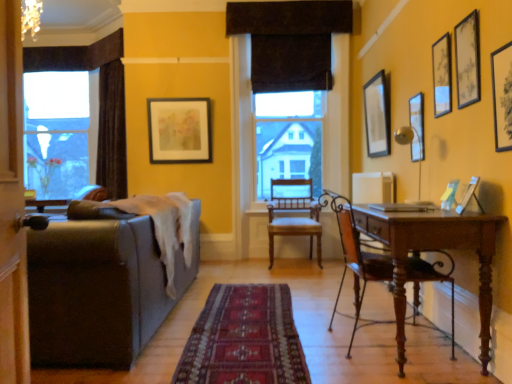
Question: Relative to leather couch at left, is matte black picture frame at upper right, which is counted as the 3th picture frame, starting from the back, in front or behind?

Choices:
 (A) front
 (B) behind

Answer: (B)

Question: Would you say matte black picture frame at upper right, the first picture frame positioned from the right, is to the left or to the right of leather couch at left in the picture?

Choices:
 (A) right
 (B) left

Answer: (A)

Question: Which object is the farthest from the matte black picture frame at upper right, acting as the sixth picture frame starting from the left?

Choices:
 (A) matte white picture frame at right, arranged as the second picture frame when viewed from the left
 (B) matte black picture frame at upper right, the second picture frame from the back
 (C) matte black picture frame at upper center, which is the 1th picture frame in back-to-front order
 (D) leather couch at left
 (E) wooden chair at center, positioned as the 2th chair in front-to-back order

Answer: (C)

Question: Estimate the real-world distances between objects in this image. Which object is closer to the matte black picture frame at upper right, placed as the fifth picture frame when sorted from front to back?

Choices:
 (A) wooden chair at center, positioned as the 2th chair in front-to-back order
 (B) matte white picture frame at right, which is the 2th picture frame in front-to-back order
 (C) brown fabric curtain at upper center
 (D) matte black picture frame at upper center, which is the 1th picture frame in back-to-front order
 (E) matte black picture frame at upper right, which is the 5th picture frame from back to front

Answer: (E)